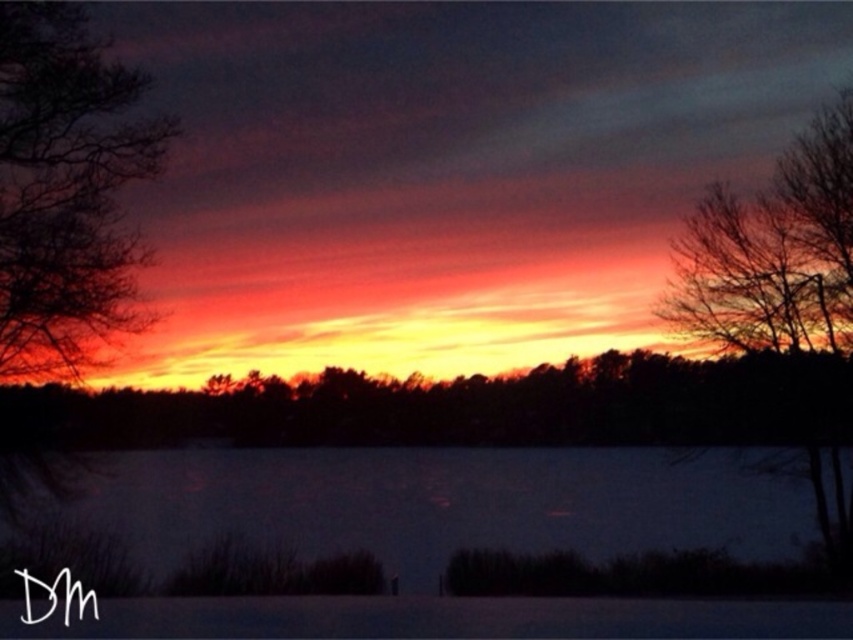
Does silhouette bare tree at left have a larger size compared to silhouette bare tree at right?

Yes, silhouette bare tree at left is bigger than silhouette bare tree at right.

Describe the element at coordinates (67, 193) in the screenshot. Image resolution: width=853 pixels, height=640 pixels. I see `silhouette bare tree at left` at that location.

Identify the location of silhouette bare tree at left. (67, 193).